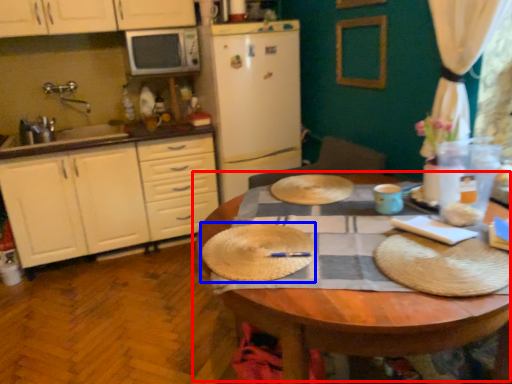
Question: Which object appears closest to the camera in this image, table (highlighted by a red box) or paper plate (highlighted by a blue box)?

Choices:
 (A) table
 (B) paper plate

Answer: (A)